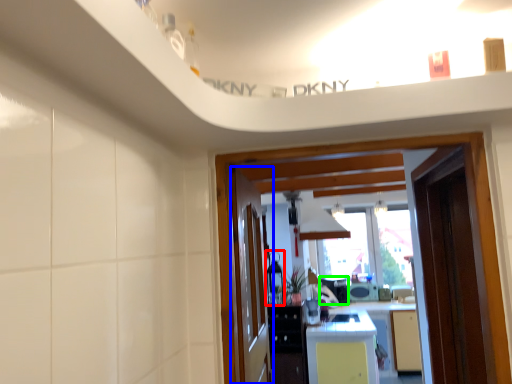
Question: Considering the real-world distances, which object is closest to appliance (highlighted by a red box)? door (highlighted by a blue box) or appliance (highlighted by a green box).

Choices:
 (A) door
 (B) appliance

Answer: (B)